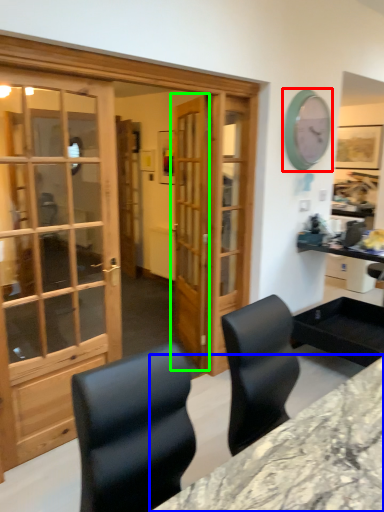
Question: Based on their relative distances, which object is farther from clock (highlighted by a red box)? Choose from desk (highlighted by a blue box) and door (highlighted by a green box).

Choices:
 (A) desk
 (B) door

Answer: (A)